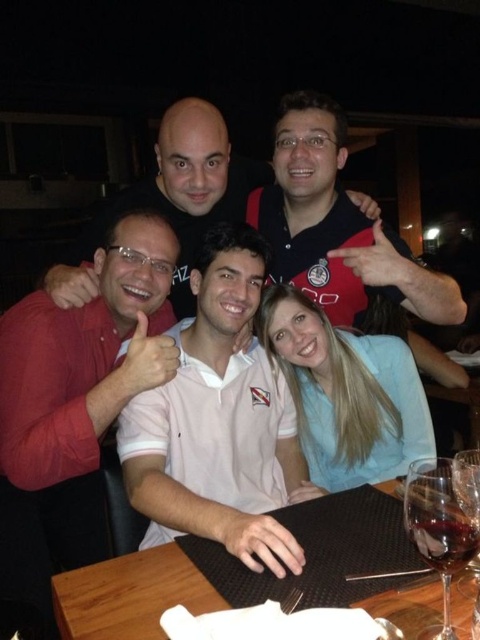
Is pink cotton polo shirt at center in front of transparent glass at table center?

No.

Can you confirm if pink cotton polo shirt at center is positioned to the left of transparent glass at table center?

Indeed, pink cotton polo shirt at center is positioned on the left side of transparent glass at table center.

I want to click on pink cotton polo shirt at center, so click(218, 422).

Which of these two, transparent glass wine at lower right or transparent glass at table center, stands shorter?

With less height is transparent glass at table center.

Does transparent glass wine at lower right lie behind transparent glass at table center?

No, transparent glass wine at lower right is closer to the viewer.

Where is `transparent glass wine at lower right`? transparent glass wine at lower right is located at coordinates (443, 522).

Can you confirm if pink cotton polo shirt at center is taller than transparent glass wine glass at lower right?

Yes, pink cotton polo shirt at center is taller than transparent glass wine glass at lower right.

Is pink cotton polo shirt at center closer to the viewer compared to transparent glass wine glass at lower right?

That is False.

Which is behind, point (248, 234) or point (474, 460)?

Point (248, 234)

Identify the location of pink cotton polo shirt at center. (218, 422).